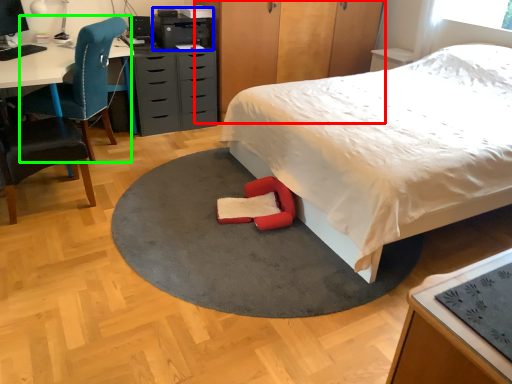
Question: Which object is positioned closest to dresser (highlighted by a red box)? Select from printer (highlighted by a blue box) and chair (highlighted by a green box).

Choices:
 (A) printer
 (B) chair

Answer: (A)